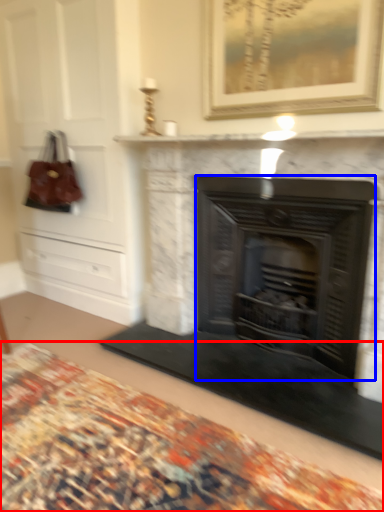
Question: Which point is further to the camera, plain (highlighted by a red box) or fireplace (highlighted by a blue box)?

Choices:
 (A) plain
 (B) fireplace

Answer: (B)